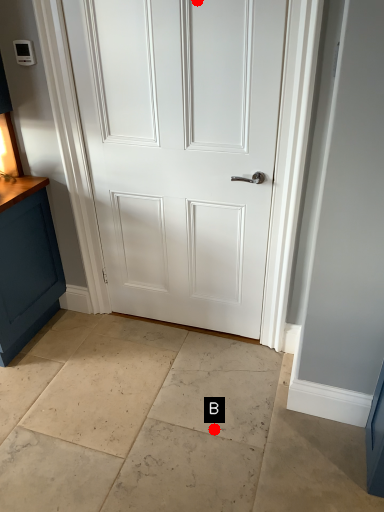
Question: Two points are circled on the image, labeled by A and B beside each circle. Which of the following is the closest to the observer?

Choices:
 (A) A is closer
 (B) B is closer

Answer: (A)